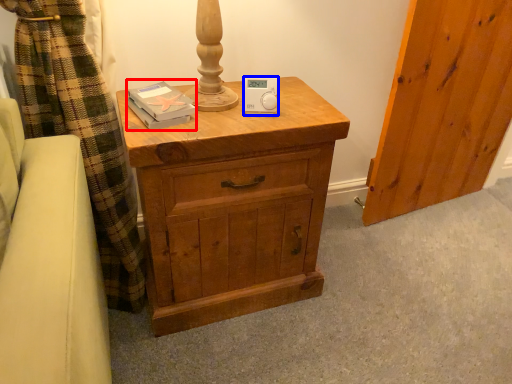
Question: Which point is closer to the camera, book (highlighted by a red box) or ipod (highlighted by a blue box)?

Choices:
 (A) book
 (B) ipod

Answer: (A)